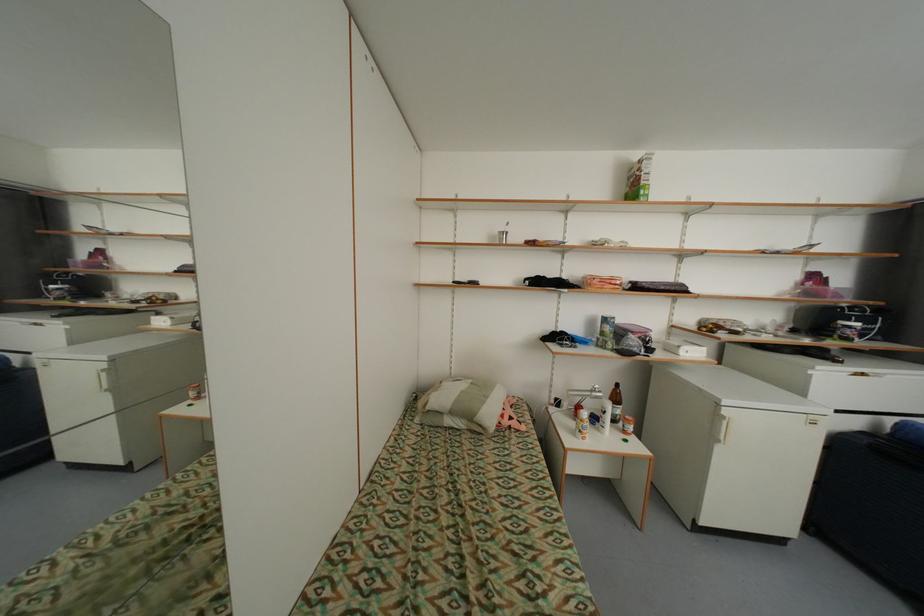
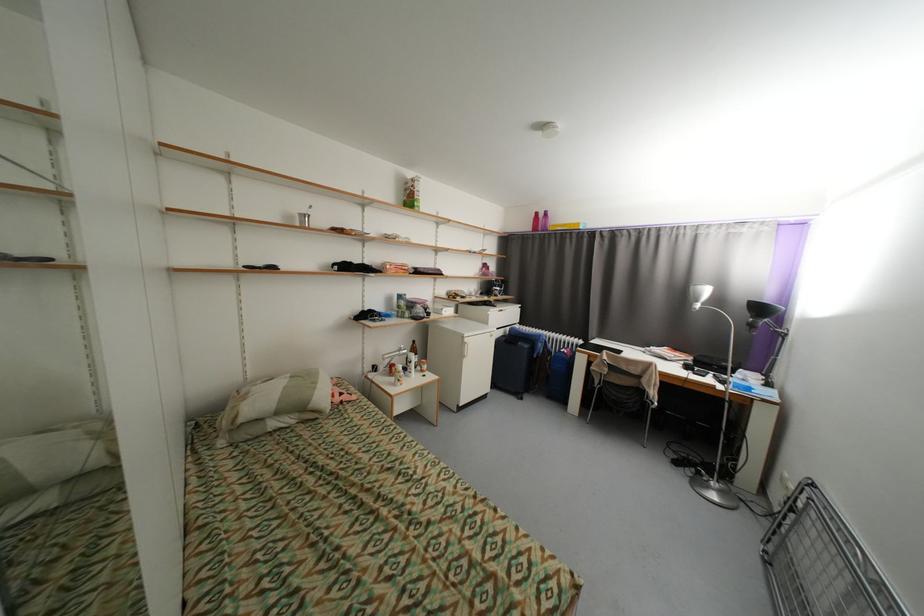
Question: The first image is from the beginning of the video and the second image is from the end. How did the camera likely rotate when shooting the video?

Choices:
 (A) Left
 (B) Right
 (C) Up
 (D) Down

Answer: (B)